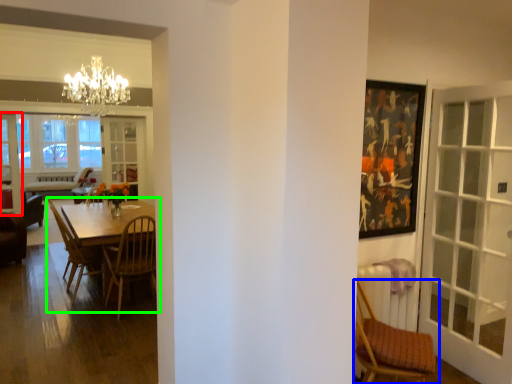
Question: Estimate the real-world distances between objects in this image. Which object is closer to screen door (highlighted by a red box), chair (highlighted by a blue box) or kitchen & dining room table (highlighted by a green box)?

Choices:
 (A) chair
 (B) kitchen & dining room table

Answer: (B)